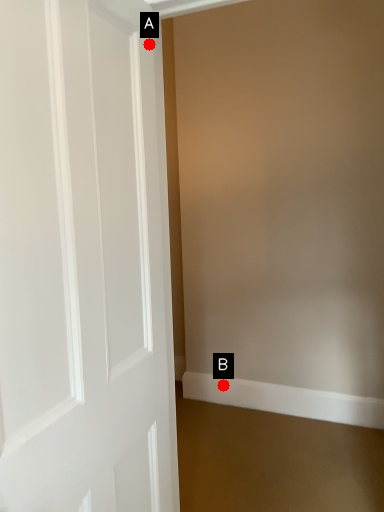
Question: Two points are circled on the image, labeled by A and B beside each circle. Which point is closer to the camera taking this photo?

Choices:
 (A) A is closer
 (B) B is closer

Answer: (A)